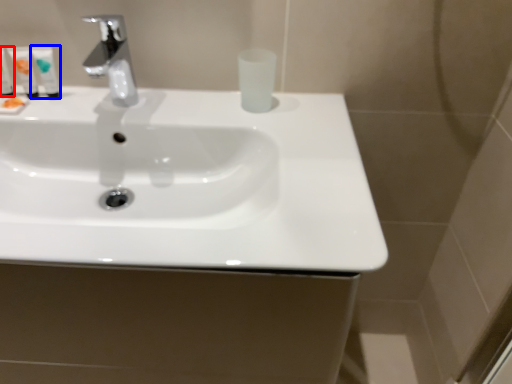
Question: Which object is further to the camera taking this photo, mouthwash (highlighted by a red box) or mouthwash (highlighted by a blue box)?

Choices:
 (A) mouthwash
 (B) mouthwash

Answer: (B)